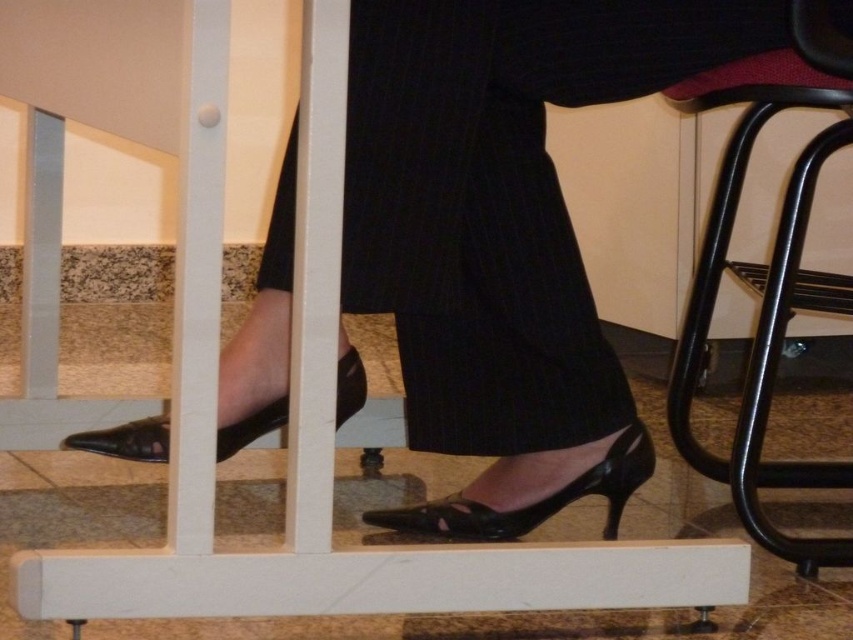
You are a security camera monitoring the entrance. There is a black pinstripe skirt at center and a black metal chair at right in your view. Which object is closer to the camera?

The black pinstripe skirt at center is closer to the camera because it is in front of the black metal chair at right.

You are a delivery robot with a 40 cm wide package. You need to move from the black metal chair at right to the black leather shoe at lower left. Is there enough space for you to pass through?

The distance between the black metal chair at right and the black leather shoe at lower left is 55.43 centimeters. Since your package is 40 cm wide, there is sufficient space to pass through as 55.43 cm is greater than 40 cm.